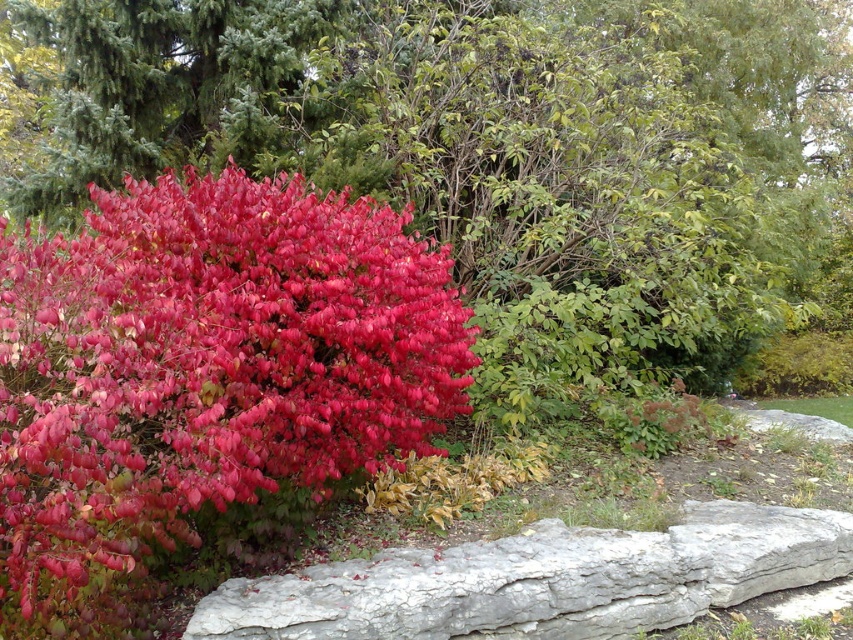
Question: Does bright red leaves at center have a smaller size compared to gray rough stone at lower center?

Choices:
 (A) no
 (B) yes

Answer: (A)

Question: Which object appears farthest from the camera in this image?

Choices:
 (A) shiny red leaves at left
 (B) bright red leaves at center

Answer: (B)

Question: Estimate the real-world distances between objects in this image. Which object is farther from the bright red leaves at center?

Choices:
 (A) gray rough stone at lower center
 (B) shiny red leaves at left

Answer: (A)

Question: Can you confirm if bright red leaves at center is positioned to the right of gray rough stone at lower center?

Choices:
 (A) no
 (B) yes

Answer: (B)

Question: Which point is farther to the camera?

Choices:
 (A) shiny red leaves at left
 (B) bright red leaves at center
 (C) gray rough stone at lower center

Answer: (B)

Question: Is bright red leaves at center above shiny red leaves at left?

Choices:
 (A) yes
 (B) no

Answer: (A)